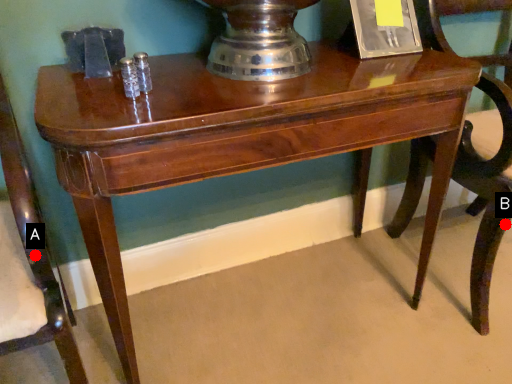
Question: Two points are circled on the image, labeled by A and B beside each circle. Which point is closer to the camera taking this photo?

Choices:
 (A) A is closer
 (B) B is closer

Answer: (A)